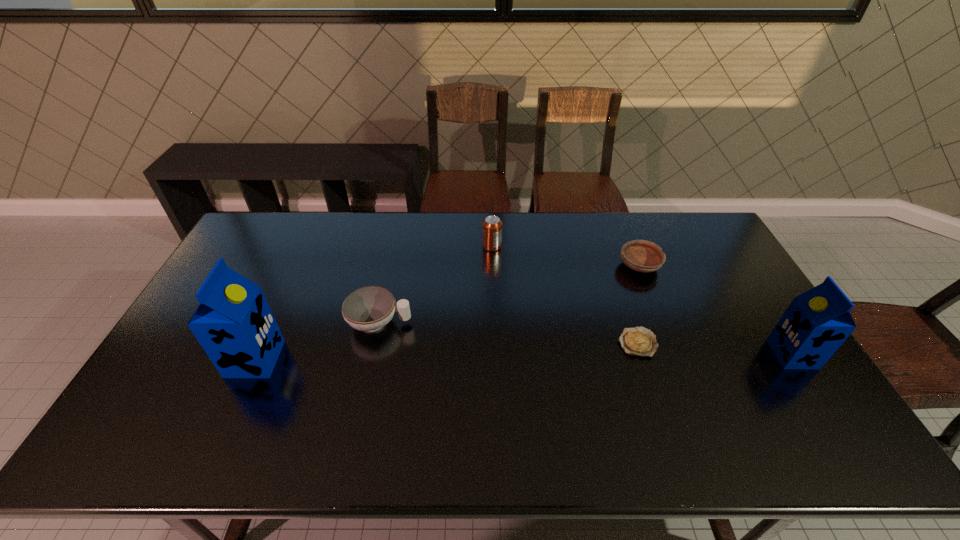
Identify the location of the leftmost object. Image resolution: width=960 pixels, height=540 pixels. (234, 324).

This screenshot has height=540, width=960. What are the coordinates of `the left carton` in the screenshot? It's located at (234, 324).

This screenshot has height=540, width=960. In order to click on the right carton in this screenshot , I will do `click(816, 323)`.

You are a GUI agent. You are given a task and a screenshot of the screen. Output one action in this format:
    pyautogui.click(x=<x>, y=<y>)
    Task: Click on the shorter carton
    The height and width of the screenshot is (540, 960).
    Given the screenshot: What is the action you would take?
    pyautogui.click(x=816, y=323)

Identify the location of bowl. (644, 256).

Where is `the fifth tallest object`? Image resolution: width=960 pixels, height=540 pixels. the fifth tallest object is located at coordinates (644, 256).

Find the location of a particular element. The image size is (960, 540). the third object from left to right is located at coordinates (491, 226).

What are the coordinates of `the farthest object` in the screenshot? It's located at (491, 226).

The width and height of the screenshot is (960, 540). In order to click on the third shortest object in this screenshot , I will do `click(369, 308)`.

This screenshot has height=540, width=960. In order to click on the second object from left to right in this screenshot , I will do `click(369, 308)`.